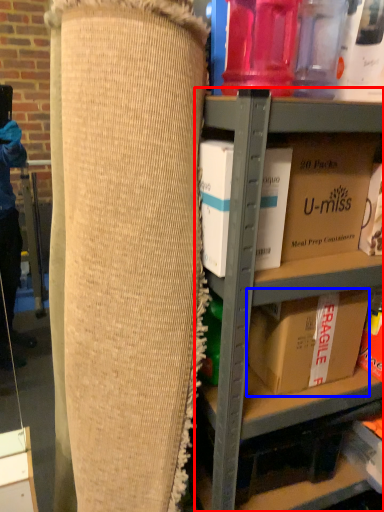
Question: Among these objects, which one is farthest to the camera, shelf (highlighted by a red box) or box (highlighted by a blue box)?

Choices:
 (A) shelf
 (B) box

Answer: (B)